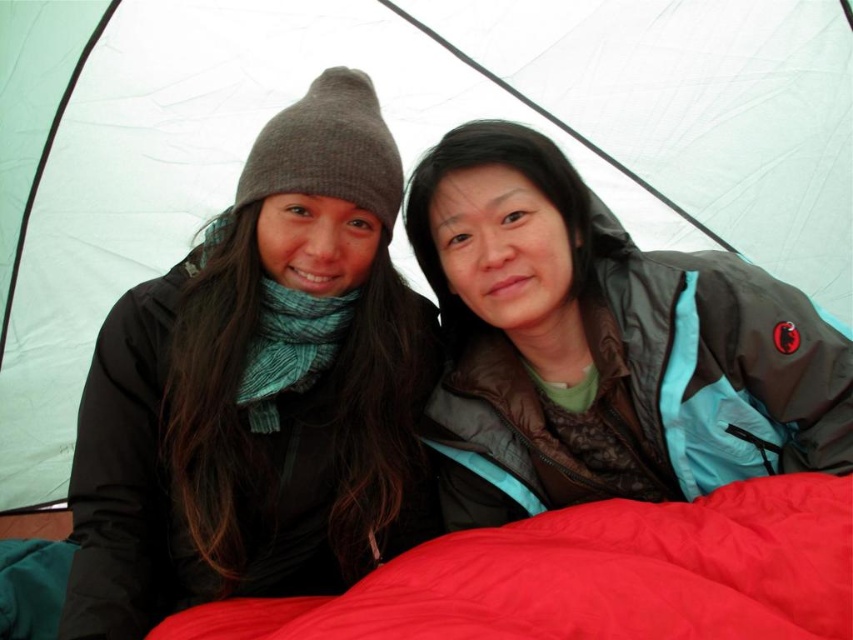
Question: Which point is farther to the camera?

Choices:
 (A) red soft fabric blanket at lower center
 (B) matte blue jacket at center
 (C) matte black jacket at left

Answer: (B)

Question: Is matte black jacket at left closer to the viewer compared to matte blue jacket at center?

Choices:
 (A) yes
 (B) no

Answer: (A)

Question: Is matte black jacket at left behind matte blue jacket at center?

Choices:
 (A) no
 (B) yes

Answer: (A)

Question: Which is nearer to the matte black jacket at left?

Choices:
 (A) matte blue jacket at center
 (B) red soft fabric blanket at lower center

Answer: (A)

Question: Does matte blue jacket at center have a lesser width compared to red soft fabric blanket at lower center?

Choices:
 (A) no
 (B) yes

Answer: (B)

Question: Among these points, which one is nearest to the camera?

Choices:
 (A) (254, 456)
 (B) (695, 637)
 (C) (592, 362)

Answer: (B)